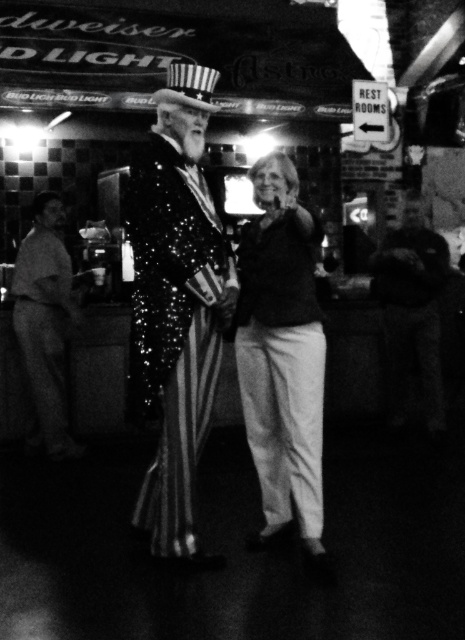
Can you confirm if sparkly sequined sailor at center is wider than smooth brown leather jacket at left?

Yes.

How distant is sparkly sequined sailor at center from smooth brown leather jacket at left?

sparkly sequined sailor at center and smooth brown leather jacket at left are 2.07 meters apart from each other.

Is point (175, 80) positioned after point (44, 224)?

No, (175, 80) is in front of (44, 224).

This screenshot has height=640, width=465. In order to click on sparkly sequined sailor at center in this screenshot , I will do `click(175, 307)`.

From the picture: Is sparkly sequined sailor at center bigger than matte black shirt at center?

Incorrect, sparkly sequined sailor at center is not larger than matte black shirt at center.

Can you confirm if sparkly sequined sailor at center is wider than matte black shirt at center?

Yes, sparkly sequined sailor at center is wider than matte black shirt at center.

Where is `sparkly sequined sailor at center`? sparkly sequined sailor at center is located at coordinates (175, 307).

Is matte black shirt at center taller than smooth brown leather jacket at left?

No, matte black shirt at center is not taller than smooth brown leather jacket at left.

Does point (309, 513) lie in front of point (50, 364)?

Yes, it is in front of point (50, 364).

Where is `matte black shirt at center`? matte black shirt at center is located at coordinates tap(281, 355).